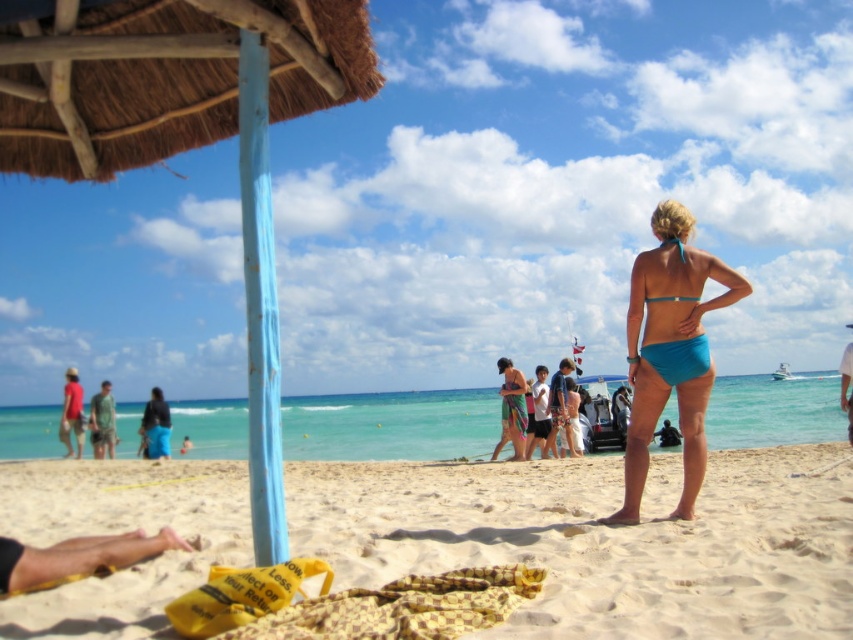
This screenshot has height=640, width=853. Identify the location of teal matte bikini at center. (677, 358).

Can you confirm if teal matte bikini at center is positioned to the left of matte red shirt at left?

No, teal matte bikini at center is not to the left of matte red shirt at left.

Who is more forward, (688, 364) or (68, 388)?

Point (688, 364) is in front.

Locate an element on the screen. teal matte bikini at center is located at coordinates (677, 358).

Who is lower down, sandy yellow at lower center or blue fabric bikini at center?

blue fabric bikini at center

Which of these two, sandy yellow at lower center or blue fabric bikini at center, stands taller?

sandy yellow at lower center

The width and height of the screenshot is (853, 640). Identify the location of sandy yellow at lower center. (602, 540).

Who is more distant from viewer, (100, 412) or (61, 428)?

Point (100, 412)

Is green fabric shorts at lower left closer to the viewer compared to matte red shirt at left?

Yes, it is in front of matte red shirt at left.

This screenshot has width=853, height=640. I want to click on green fabric shorts at lower left, so click(102, 420).

At what (x,y) coordinates should I click in order to perform the action: click on green fabric shorts at lower left. Please return your answer as a coordinate pair (x, y). The height and width of the screenshot is (640, 853). Looking at the image, I should click on click(102, 420).